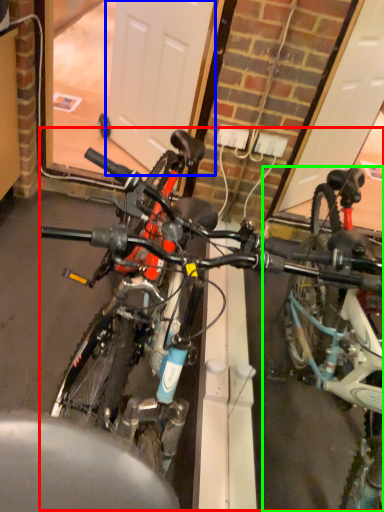
Question: Which is farther away from bicycle (highlighted by a red box)? garage door (highlighted by a blue box) or bicycle (highlighted by a green box)?

Choices:
 (A) garage door
 (B) bicycle

Answer: (A)